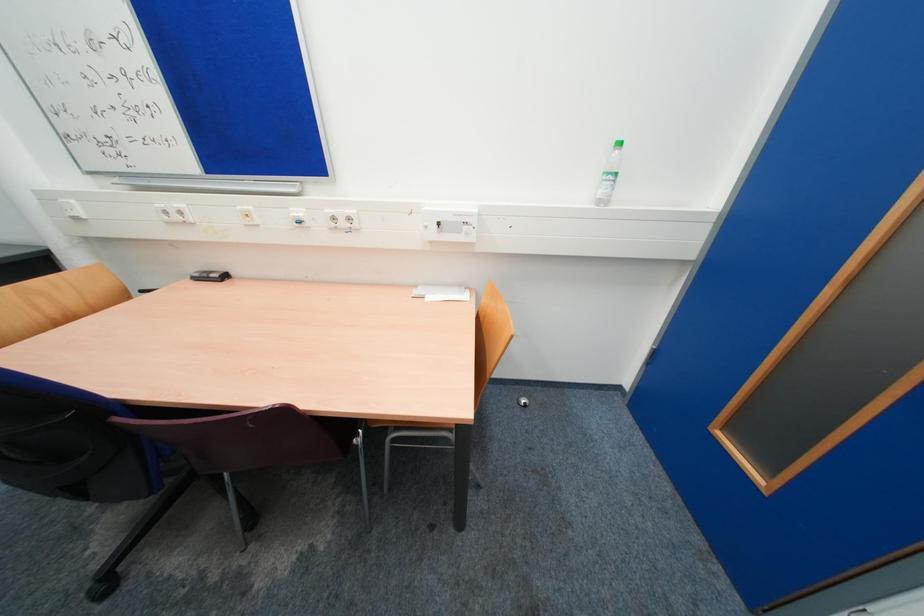
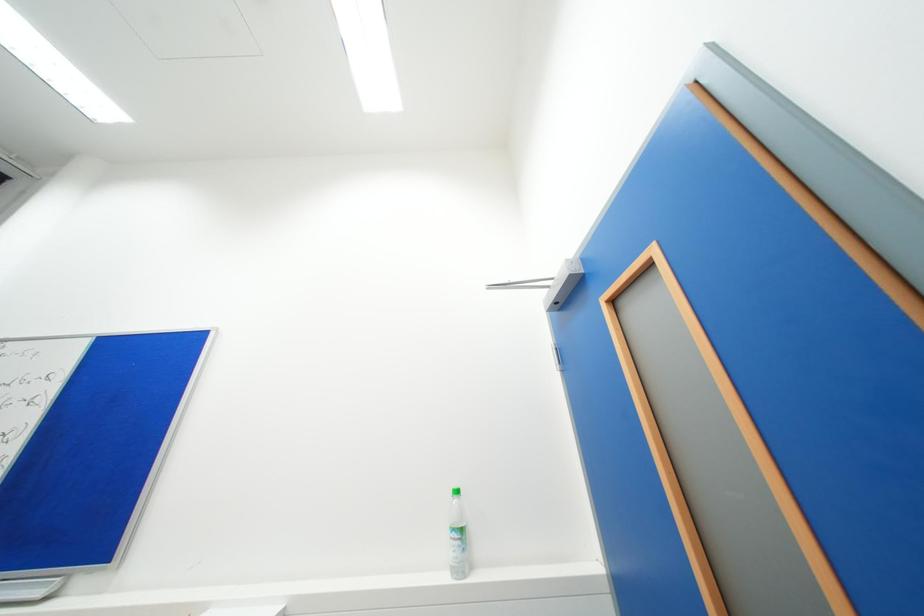
Question: The images are taken continuously from a first-person perspective. In which direction is your viewpoint rotating?

Choices:
 (A) Left
 (B) Right
 (C) Up
 (D) Down

Answer: (C)